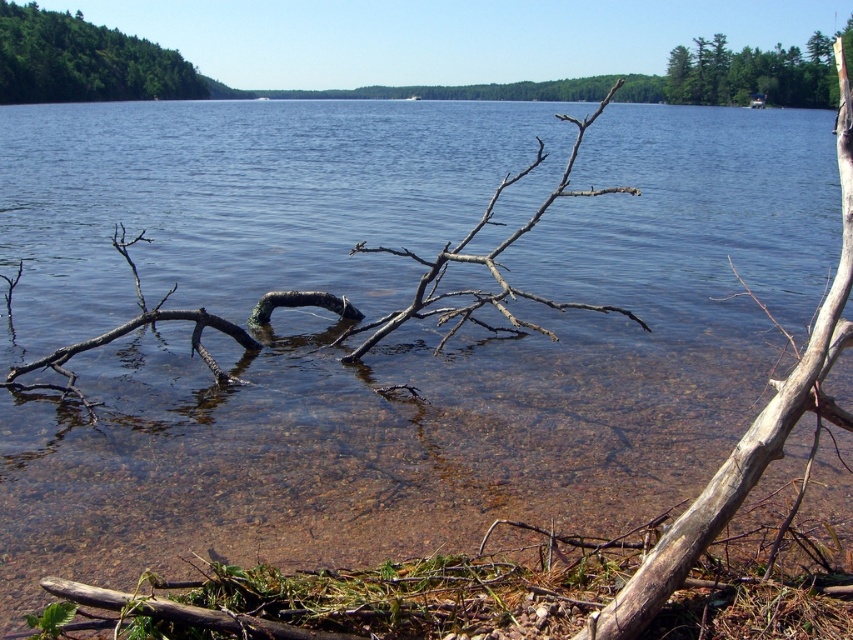
Is the position of green leafy tree at upper left more distant than that of green leafy tree at upper right?

Yes, green leafy tree at upper left is behind green leafy tree at upper right.

Identify the location of green leafy tree at upper left. (83, 61).

Is point (48, 33) positioned after point (811, 106)?

Yes, point (48, 33) is behind point (811, 106).

Where is `green leafy tree at upper left`? green leafy tree at upper left is located at coordinates (83, 61).

Looking at this image, between brown rough branch at center and green leafy tree at upper left, which one has less height?

brown rough branch at center

Is the position of brown rough branch at center more distant than that of green leafy tree at upper left?

No, it is in front of green leafy tree at upper left.

Find the location of `brown rough branch at center`. brown rough branch at center is located at coordinates (457, 262).

Where is `brown rough branch at center`? Image resolution: width=853 pixels, height=640 pixels. brown rough branch at center is located at coordinates (457, 262).

Is brown rough branch at center taller than green leafy tree at upper right?

No, brown rough branch at center is not taller than green leafy tree at upper right.

Which is in front, point (508, 243) or point (711, 72)?

Point (508, 243) is more forward.

Is point (616, 307) closer to viewer compared to point (831, 36)?

Yes, it is.

Identify the location of brown rough branch at center. (457, 262).